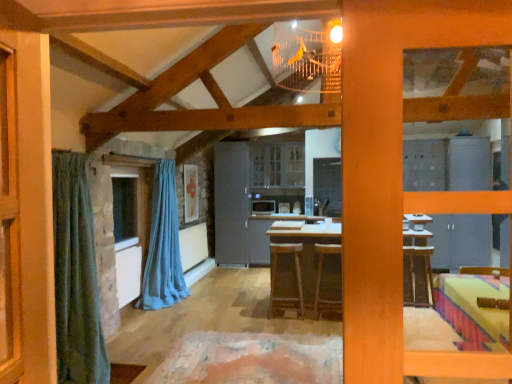
Question: Is gray matte refrigerator at center inside brown wooden stool at center, positioned as the 2th stool in left-to-right order?

Choices:
 (A) yes
 (B) no

Answer: (B)

Question: From the image's perspective, is brown wooden stool at center, which is counted as the 1th stool, starting from the right, under gray matte refrigerator at center?

Choices:
 (A) yes
 (B) no

Answer: (A)

Question: Is the depth of brown wooden stool at center, which is counted as the 1th stool, starting from the right, greater than that of gray matte refrigerator at center?

Choices:
 (A) no
 (B) yes

Answer: (A)

Question: Considering the relative sizes of brown wooden stool at center, positioned as the 2th stool in left-to-right order, and gray matte refrigerator at center in the image provided, is brown wooden stool at center, positioned as the 2th stool in left-to-right order, shorter than gray matte refrigerator at center?

Choices:
 (A) yes
 (B) no

Answer: (A)

Question: Is brown wooden stool at center, which is counted as the 1th stool, starting from the right, completely or partially outside of gray matte refrigerator at center?

Choices:
 (A) no
 (B) yes

Answer: (B)

Question: Can you confirm if brown wooden stool at center, positioned as the 2th stool in left-to-right order, is positioned to the right of gray matte refrigerator at center?

Choices:
 (A) yes
 (B) no

Answer: (A)

Question: Is brown wooden stool at center, which ranks as the 2th stool in right-to-left order, inside brown wooden stool at center, which is counted as the 1th stool, starting from the right?

Choices:
 (A) yes
 (B) no

Answer: (B)

Question: Is brown wooden stool at center, which is counted as the 1th stool, starting from the right, thinner than brown wooden stool at center, the 1th stool positioned from the left?

Choices:
 (A) no
 (B) yes

Answer: (A)

Question: Considering the relative sizes of brown wooden stool at center, positioned as the 2th stool in left-to-right order, and brown wooden stool at center, the 1th stool positioned from the left, in the image provided, is brown wooden stool at center, positioned as the 2th stool in left-to-right order, wider than brown wooden stool at center, the 1th stool positioned from the left,?

Choices:
 (A) no
 (B) yes

Answer: (B)

Question: From a real-world perspective, is brown wooden stool at center, which is counted as the 1th stool, starting from the right, on brown wooden stool at center, the 1th stool positioned from the left?

Choices:
 (A) yes
 (B) no

Answer: (B)

Question: Is brown wooden stool at center, positioned as the 2th stool in left-to-right order, located outside brown wooden stool at center, which ranks as the 2th stool in right-to-left order?

Choices:
 (A) yes
 (B) no

Answer: (A)

Question: Considering the relative sizes of brown wooden stool at center, positioned as the 2th stool in left-to-right order, and brown wooden stool at center, the 1th stool positioned from the left, in the image provided, is brown wooden stool at center, positioned as the 2th stool in left-to-right order, taller than brown wooden stool at center, the 1th stool positioned from the left,?

Choices:
 (A) no
 (B) yes

Answer: (A)

Question: Is wooden table at center smaller than brown wooden stool at center, positioned as the 2th stool in left-to-right order?

Choices:
 (A) yes
 (B) no

Answer: (B)